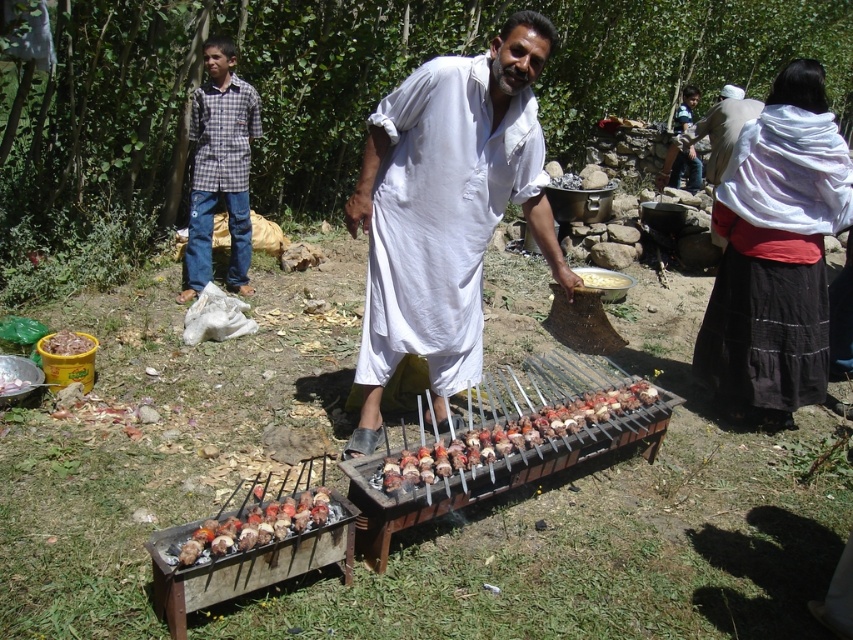
Is charcoal grilled meat skewers at center bigger than smooth brown meat skewers at center?

Indeed, charcoal grilled meat skewers at center has a larger size compared to smooth brown meat skewers at center.

Is charcoal grilled meat skewers at center positioned in front of smooth brown meat skewers at center?

Yes.

Does point (210, 522) come farther from viewer compared to point (22, 390)?

No, it is not.

Identify the location of charcoal grilled meat skewers at center. (256, 525).

Is white cloth at center to the left of white textured scarf at right from the viewer's perspective?

Correct, you'll find white cloth at center to the left of white textured scarf at right.

Which of these two, white cloth at center or white textured scarf at right, stands shorter?

With less height is white textured scarf at right.

Where is `white cloth at center`? white cloth at center is located at coordinates (445, 209).

How distant is white cloth at center from smooth brown meat skewers at center?

white cloth at center is 6.91 feet from smooth brown meat skewers at center.

Does white cloth at center have a smaller size compared to smooth brown meat skewers at center?

Actually, white cloth at center might be larger than smooth brown meat skewers at center.

Image resolution: width=853 pixels, height=640 pixels. Describe the element at coordinates (445, 209) in the screenshot. I see `white cloth at center` at that location.

The image size is (853, 640). I want to click on white cloth at center, so click(445, 209).